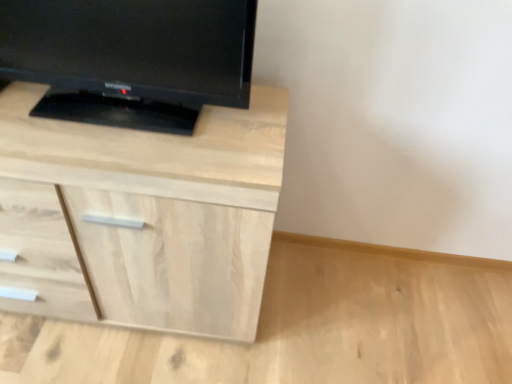
Where is `free space in front of matte black tv at upper left`? The height and width of the screenshot is (384, 512). free space in front of matte black tv at upper left is located at coordinates (102, 146).